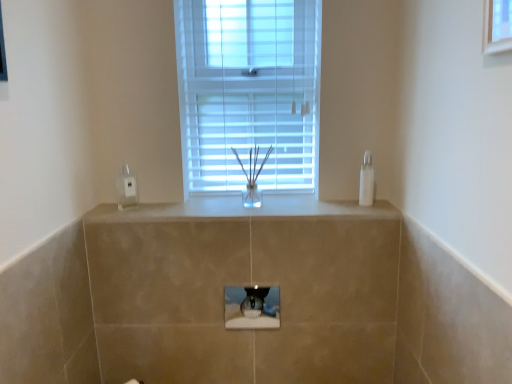
I want to click on vacant area on the back side of clear plastic electric outlet at left, so click(133, 201).